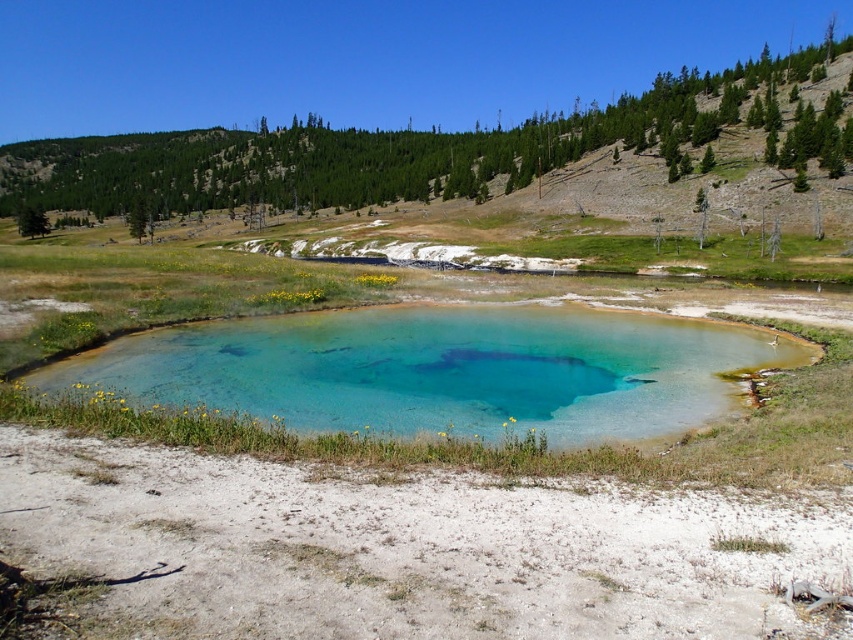
You are planning to build a small garden shed that requires a 10 square meter space. You have two options for locations in the scene described. The first is near the turquoise glass pond at center, and the second is near the green grassy hillside at upper center. Based on the size of these two areas, which location would provide more space for your shed?

The green grassy hillside at upper center is larger than the turquoise glass pond at center, so it would provide more space for the shed.

You are standing at the edge of the turquoise glass pond at center and want to walk towards the green grassy hillside at upper center. Which direction should you face to move towards it?

Since the turquoise glass pond at center is closer to the viewer than the green grassy hillside at upper center, you should face upwards to move towards the green grassy hillside at upper center.

You are standing at the edge of the turquoise glass pond at center and want to climb up to the green grassy hillside at upper center. Based on the scene description, which direction should you face to head towards the hillside?

The green grassy hillside at upper center is located above the turquoise glass pond at center, so you should face upwards or towards the upper part of the scene to head towards it.